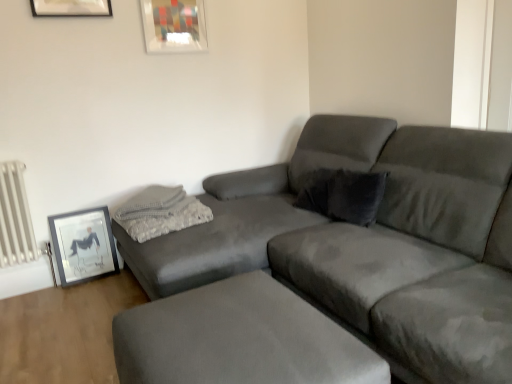
Question: Does suede gray couch at center have a lesser height compared to white metallic radiator at left?

Choices:
 (A) yes
 (B) no

Answer: (B)

Question: From the image's perspective, is suede gray couch at center above white metallic radiator at left?

Choices:
 (A) yes
 (B) no

Answer: (A)

Question: Can you confirm if suede gray couch at center is positioned to the left of white metallic radiator at left?

Choices:
 (A) yes
 (B) no

Answer: (B)

Question: Is suede gray couch at center turned away from white metallic radiator at left?

Choices:
 (A) yes
 (B) no

Answer: (B)

Question: Can you confirm if suede gray couch at center is taller than white metallic radiator at left?

Choices:
 (A) no
 (B) yes

Answer: (B)

Question: From a real-world perspective, is suede gray couch at center physically located above or below matte glass picture frame at upper center, which is the first picture frame from top to bottom?

Choices:
 (A) above
 (B) below

Answer: (B)

Question: Relative to matte glass picture frame at upper center, the 2th picture frame viewed from the left, is suede gray couch at center in front or behind?

Choices:
 (A) front
 (B) behind

Answer: (A)

Question: In the image, is suede gray couch at center on the left side or the right side of matte glass picture frame at upper center, which is the first picture frame from top to bottom?

Choices:
 (A) right
 (B) left

Answer: (A)

Question: From the image's perspective, is suede gray couch at center located above or below matte glass picture frame at upper center, which is counted as the 1th picture frame, starting from the right?

Choices:
 (A) below
 (B) above

Answer: (A)

Question: Would you say matte black picture frame at lower left, the first picture frame positioned from the left, is to the left or to the right of suede gray couch at center in the picture?

Choices:
 (A) left
 (B) right

Answer: (A)

Question: Considering the positions of point (97, 211) and point (155, 360), is point (97, 211) closer or farther from the camera than point (155, 360)?

Choices:
 (A) farther
 (B) closer

Answer: (A)

Question: Is matte black picture frame at lower left, acting as the 2th picture frame starting from the top, inside or outside of suede gray couch at center?

Choices:
 (A) outside
 (B) inside

Answer: (A)

Question: From the image's perspective, is matte black picture frame at lower left, acting as the 2th picture frame starting from the top, above or below suede gray couch at center?

Choices:
 (A) below
 (B) above

Answer: (A)

Question: Based on their sizes in the image, would you say matte glass picture frame at upper center, which is counted as the 1th picture frame, starting from the right, is bigger or smaller than white metallic radiator at left?

Choices:
 (A) big
 (B) small

Answer: (B)

Question: In terms of height, does matte glass picture frame at upper center, which is counted as the 1th picture frame, starting from the right, look taller or shorter compared to white metallic radiator at left?

Choices:
 (A) tall
 (B) short

Answer: (B)